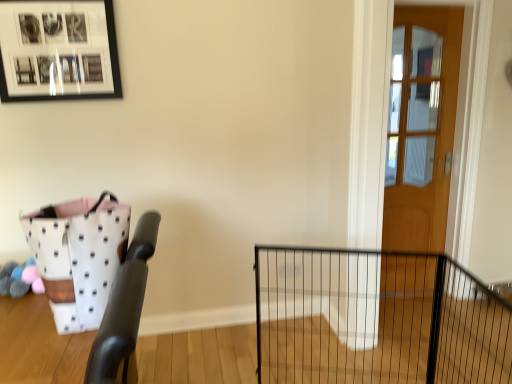
Question: From the image's perspective, is black wire fence at center positioned above or below black matte picture frame at upper left?

Choices:
 (A) above
 (B) below

Answer: (B)

Question: Considering the relative positions of black wire fence at center and black matte picture frame at upper left in the image provided, is black wire fence at center to the left or to the right of black matte picture frame at upper left?

Choices:
 (A) right
 (B) left

Answer: (A)

Question: Which object is positioned farthest from the wooden door at right?

Choices:
 (A) black matte picture frame at upper left
 (B) black wire fence at center
 (C) white dotted fabric basket at left

Answer: (C)

Question: Which is farther from the white dotted fabric basket at left?

Choices:
 (A) black matte picture frame at upper left
 (B) black wire fence at center
 (C) wooden door at right

Answer: (C)